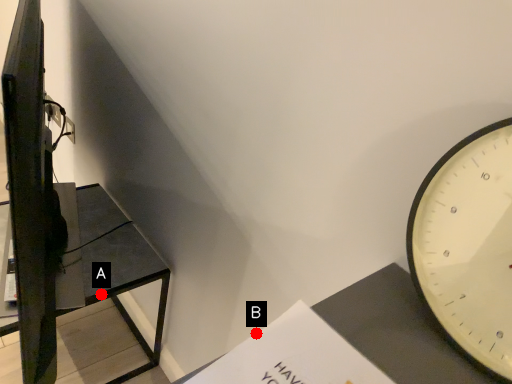
Question: Two points are circled on the image, labeled by A and B beside each circle. Which point appears closest to the camera in this image?

Choices:
 (A) A is closer
 (B) B is closer

Answer: (B)